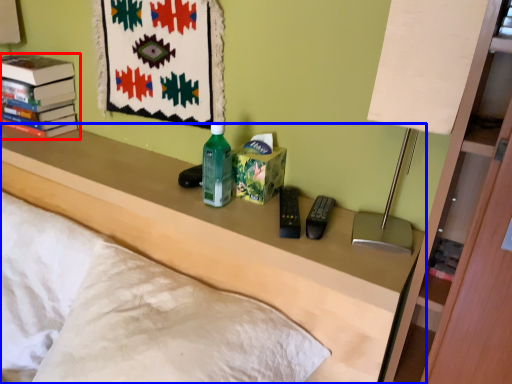
Question: Which point is closer to the camera, book (highlighted by a red box) or furniture (highlighted by a blue box)?

Choices:
 (A) book
 (B) furniture

Answer: (B)